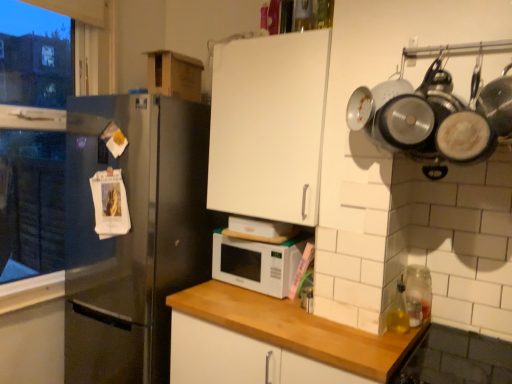
Identify the location of free space in front of white matte microwave at center. (255, 305).